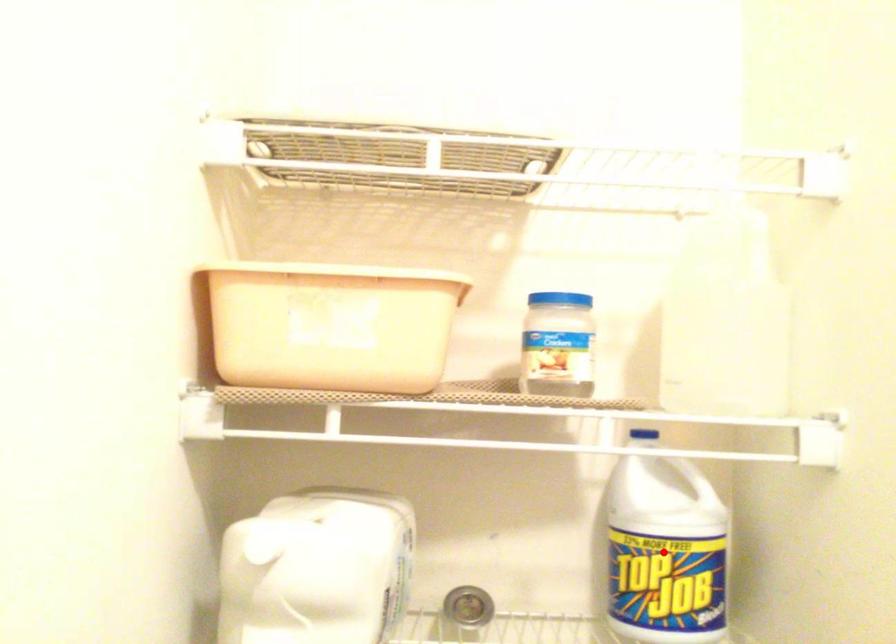
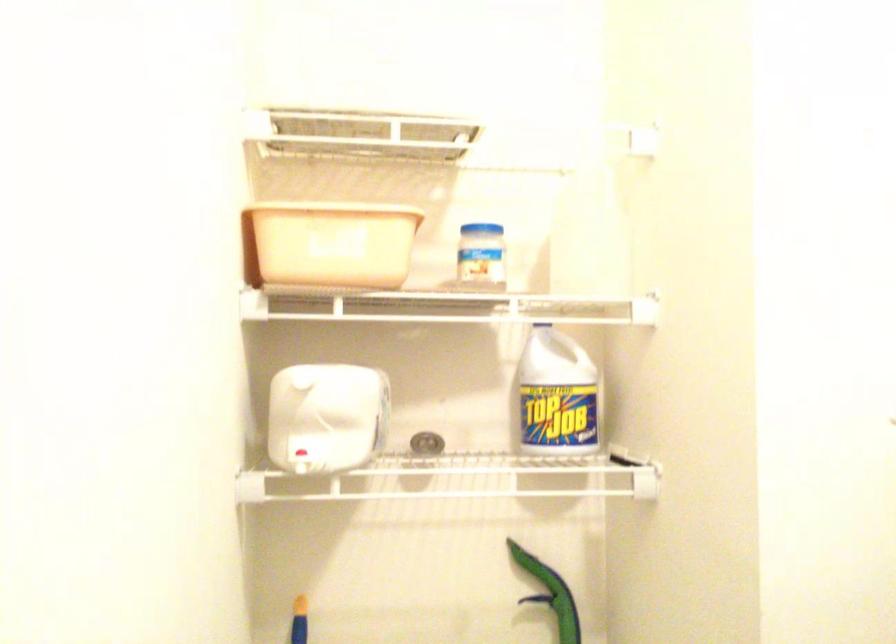
Where in the second image is the point corresponding to the highlighted location from the first image?

(556, 395)